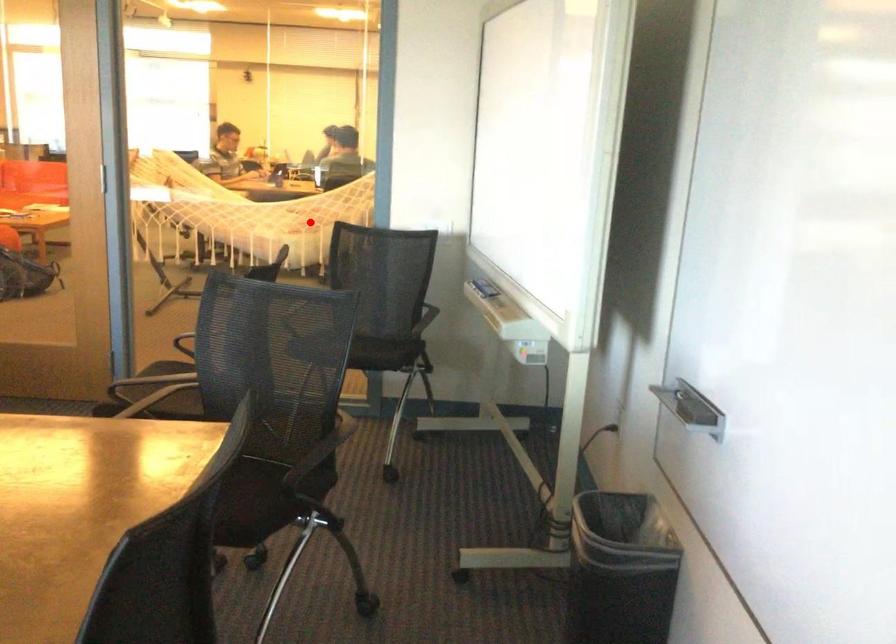
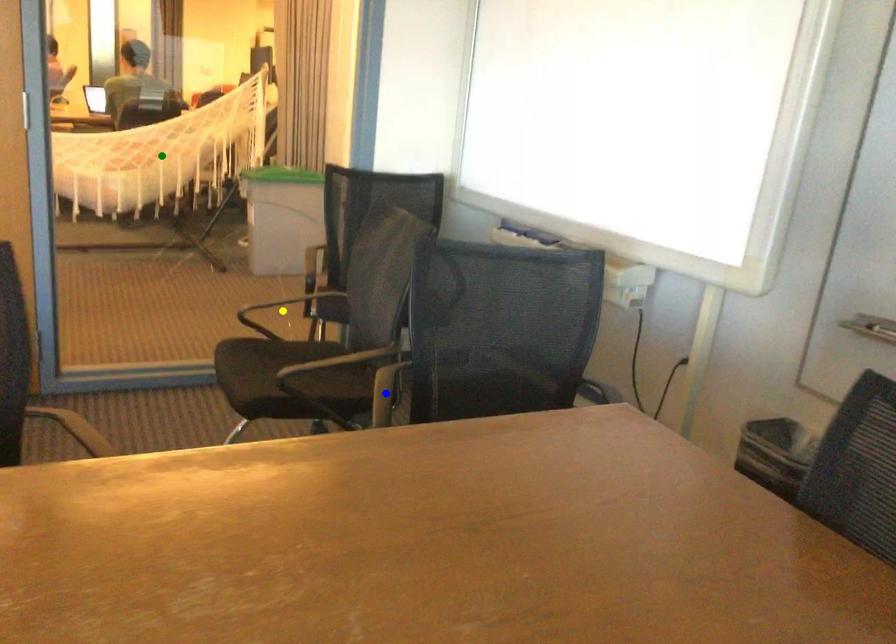
Question: I am providing you with two images of the same scene from different viewpoints. A red point is marked on the first image. You are given multiple points on the second image. Which point in image 2 is actually the same real-world point as the red point in image 1?

Choices:
 (A) yellow point
 (B) green point
 (C) blue point

Answer: (B)